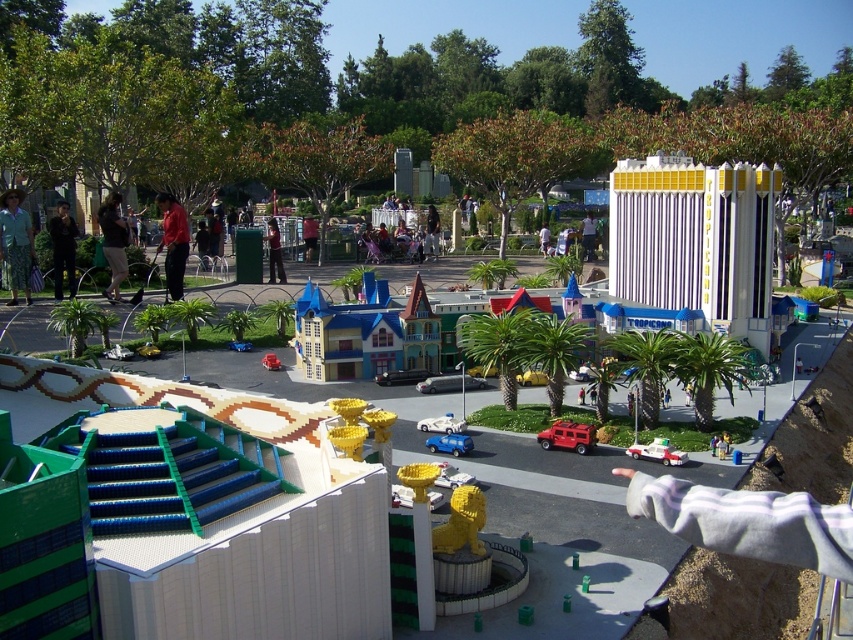
This screenshot has height=640, width=853. In order to click on dark brown leather jacket at center in this screenshot , I will do `click(113, 243)`.

The width and height of the screenshot is (853, 640). What do you see at coordinates (113, 243) in the screenshot?
I see `dark brown leather jacket at center` at bounding box center [113, 243].

The height and width of the screenshot is (640, 853). Identify the location of dark brown leather jacket at center. (113, 243).

Is camouflage pants at left further to camera compared to red plastic fire truck at center?

Yes, it is.

The width and height of the screenshot is (853, 640). What do you see at coordinates (15, 244) in the screenshot? I see `camouflage pants at left` at bounding box center [15, 244].

This screenshot has width=853, height=640. I want to click on camouflage pants at left, so click(x=15, y=244).

In order to click on camouflage pants at left in this screenshot , I will do `click(15, 244)`.

Does red plastic fire truck at center appear on the left side of translucent plastic car at center?

Yes, red plastic fire truck at center is to the left of translucent plastic car at center.

Is red plastic fire truck at center wider than translucent plastic car at center?

Yes, red plastic fire truck at center is wider than translucent plastic car at center.

Is point (541, 436) farther from camera compared to point (639, 449)?

Yes, it is behind point (639, 449).

At what (x,y) coordinates should I click in order to perform the action: click on red plastic fire truck at center. Please return your answer as a coordinate pair (x, y). The image size is (853, 640). Looking at the image, I should click on (567, 436).